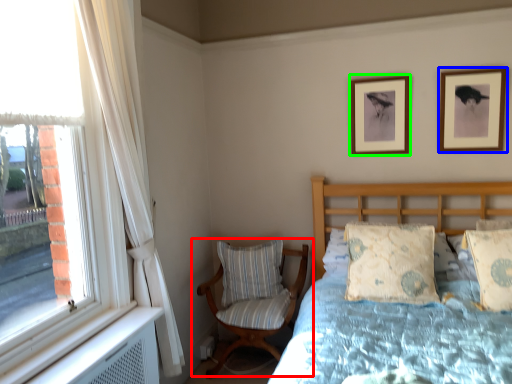
Question: Based on their relative distances, which object is farther from chair (highlighted by a red box)? Choose from picture frame (highlighted by a blue box) and picture frame (highlighted by a green box).

Choices:
 (A) picture frame
 (B) picture frame

Answer: (A)